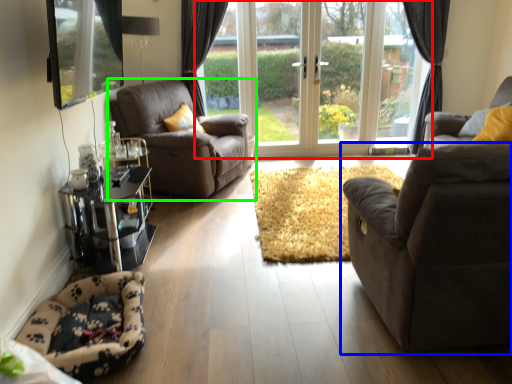
Question: Based on their relative distances, which object is farther from door (highlighted by a red box)? Choose from studio couch (highlighted by a blue box) and chair (highlighted by a green box).

Choices:
 (A) studio couch
 (B) chair

Answer: (A)